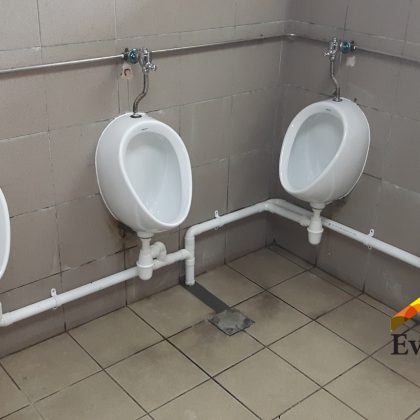
Identify the location of metal bar to hang urinals on. Image resolution: width=420 pixels, height=420 pixels. (185, 49), (96, 60), (386, 52).